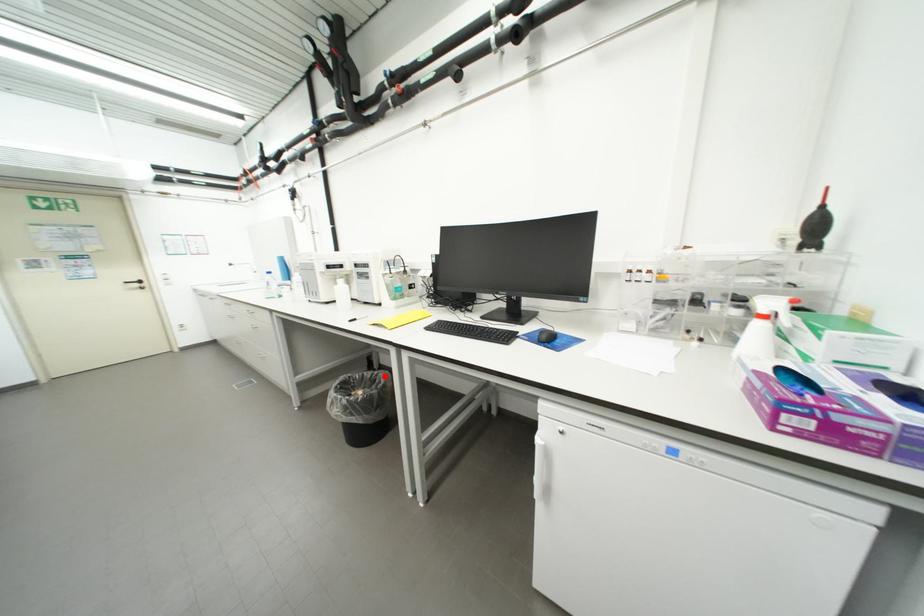
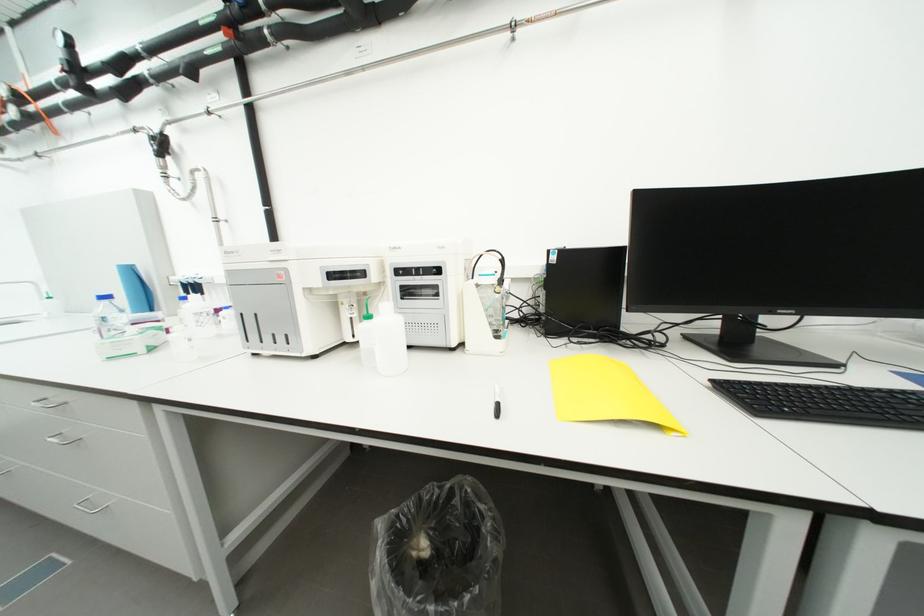
The point at the highlighted location is marked in the first image. Where is the corresponding point in the second image?

(459, 493)